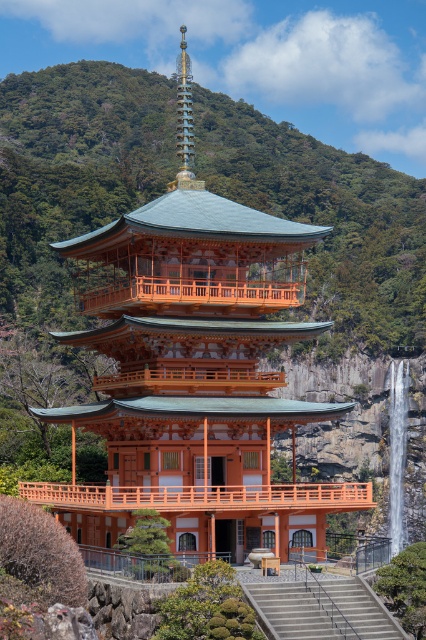
From the picture: You are standing at the entrance of a mountain trail and see the orange wood pagoda at center. If you want to reach it, in which general direction should you walk from your current position?

Result: Since the orange wood pagoda at center is located at point (193, 371), you should walk towards the center of the image to reach it.